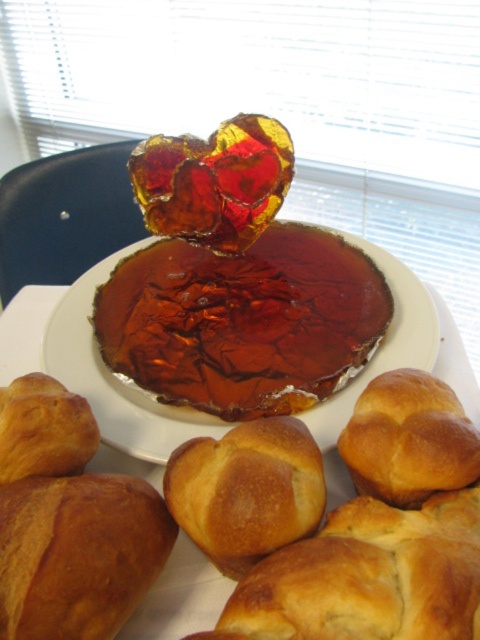
You are looking at the baked goods on the plate. There are two points marked on the image. The first point is at coordinates point (217, 385) and the second is at point (146, 484). Which of these points is closer to you?

Point (217, 385) is further to the camera than point (146, 484), so the point closer to you is point (146, 484).

You are a baker trying to fit both the golden brown doughnut at lower right and the golden brown croissant at lower left into a rectangular box. The box can only accommodate items up to the size of the doughnut. Can both fit if placed side by side?

The golden brown doughnut at lower right is wider than the golden brown croissant at lower left. Since the box can only fit up to the doughnut size, placing them side by side would exceed the box width as the combined width of both items would be greater than the doughnut alone.

You are a chef arranging desserts on a table. You have a shiny brown cake at center and a golden brown crusty croissant at lower left. If you want to place a garnish in front of both items, where should you put it?

The golden brown crusty croissant at lower left is behind the shiny brown cake at center, so placing the garnish in front of the shiny brown cake at center would also place it in front of the golden brown crusty croissant at lower left.